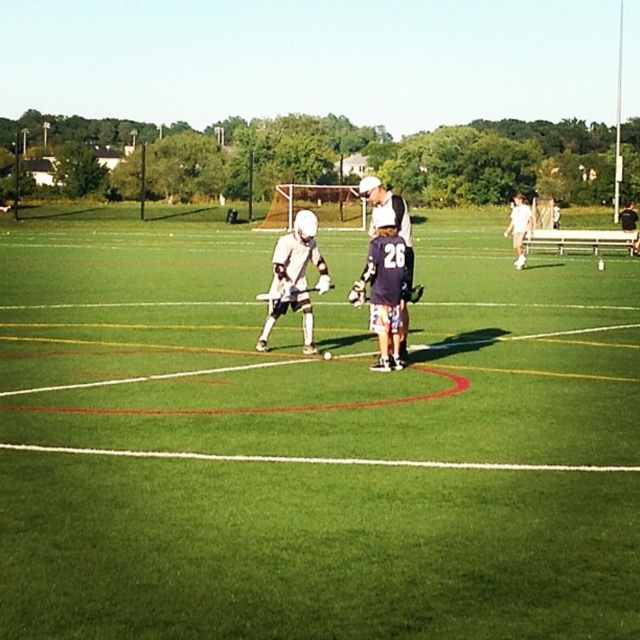
This screenshot has height=640, width=640. Describe the element at coordinates (310, 440) in the screenshot. I see `green grass field at center` at that location.

Which of these two, green grass field at center or white matte uniform at center, stands shorter?

green grass field at center

I want to click on green grass field at center, so click(310, 440).

Where is `green grass field at center`? green grass field at center is located at coordinates (310, 440).

Who is more distant from viewer, [163,417] or [269,312]?

Point [269,312]

Can you confirm if green grass field at center is positioned to the left of white matte lacrosse stick at center?

In fact, green grass field at center is to the right of white matte lacrosse stick at center.

The image size is (640, 640). Find the location of `green grass field at center`. green grass field at center is located at coordinates (310, 440).

The height and width of the screenshot is (640, 640). I want to click on green grass field at center, so click(x=310, y=440).

Who is lower down, white matte lacrosse stick at center or white matte uniform at center?

Positioned lower is white matte lacrosse stick at center.

The width and height of the screenshot is (640, 640). Describe the element at coordinates (294, 278) in the screenshot. I see `white matte lacrosse stick at center` at that location.

This screenshot has height=640, width=640. Describe the element at coordinates (294, 278) in the screenshot. I see `white matte lacrosse stick at center` at that location.

Identify the location of white matte lacrosse stick at center. This screenshot has width=640, height=640. (294, 278).